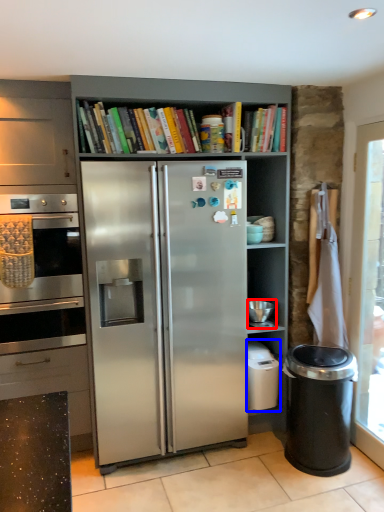
Question: Which of the following is the farthest to the observer, appliance (highlighted by a red box) or dish washer (highlighted by a blue box)?

Choices:
 (A) appliance
 (B) dish washer

Answer: (B)